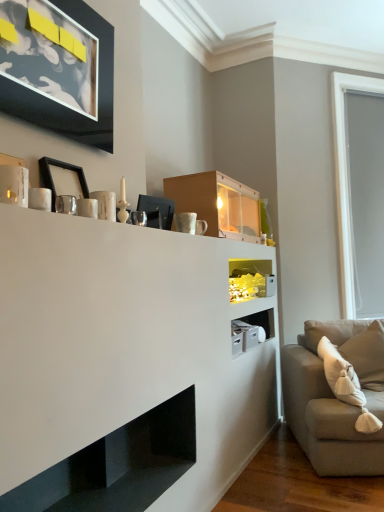
Question: Relative to matte wood cabinet at upper center, is light gray fabric couch at right in front or behind?

Choices:
 (A) front
 (B) behind

Answer: (A)

Question: Considering the relative positions of light gray fabric couch at right and matte wood cabinet at upper center in the image provided, is light gray fabric couch at right to the left or to the right of matte wood cabinet at upper center?

Choices:
 (A) right
 (B) left

Answer: (A)

Question: Which of these objects is positioned farthest from the gray matte window screen at right?

Choices:
 (A) black matte picture frame at upper left, the second picture frame positioned from the top
 (B) black matte picture frame at upper left, which is counted as the 1th picture frame, starting from the top
 (C) beige soft cushion at right
 (D) translucent glass shelf at center, positioned as the 1th shelf in back-to-front order
 (E) light gray fabric couch at right

Answer: (A)

Question: Based on their relative distances, which object is farther from the black matte picture frame at upper left, which is counted as the 1th picture frame, starting from the top?

Choices:
 (A) translucent glass shelf at center, which appears as the 1th shelf when viewed from the top
 (B) beige soft cushion at right
 (C) gray matte window screen at right
 (D) matte wood cabinet at upper center
 (E) black matte picture frame at upper left, the second picture frame positioned from the top

Answer: (C)